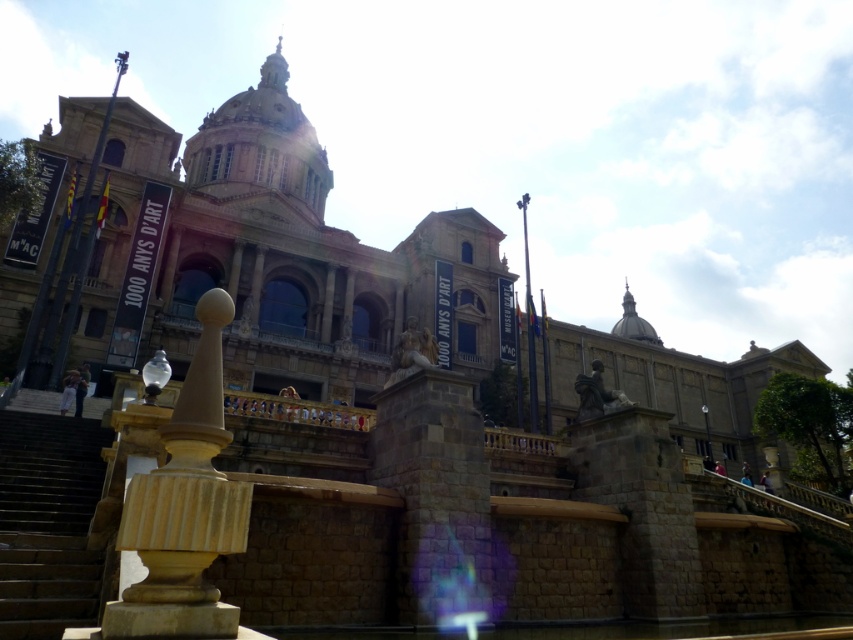
Is brown stone church at center wider than brown stone stairs at lower left?

Yes.

How much distance is there between brown stone church at center and brown stone stairs at lower left?

brown stone church at center is 60.52 meters away from brown stone stairs at lower left.

Is point (271, 380) more distant than point (36, 538)?

Yes, it is.

This screenshot has width=853, height=640. I want to click on brown stone church at center, so click(x=277, y=259).

Is brown stone church at center positioned in front of beige polished stone pillar at center?

No, it is behind beige polished stone pillar at center.

Is brown stone church at center below beige polished stone pillar at center?

Actually, brown stone church at center is above beige polished stone pillar at center.

Image resolution: width=853 pixels, height=640 pixels. What do you see at coordinates (277, 259) in the screenshot? I see `brown stone church at center` at bounding box center [277, 259].

Identify the location of brown stone church at center. Image resolution: width=853 pixels, height=640 pixels. (277, 259).

In the scene shown: Between beige polished stone pillar at center and brown stone stairs at lower left, which one appears on the left side from the viewer's perspective?

From the viewer's perspective, brown stone stairs at lower left appears more on the left side.

Between point (122, 636) and point (39, 522), which one is positioned behind?

The point (39, 522) is behind.

Where is `beige polished stone pillar at center`? beige polished stone pillar at center is located at coordinates (184, 508).

I want to click on beige polished stone pillar at center, so click(x=184, y=508).